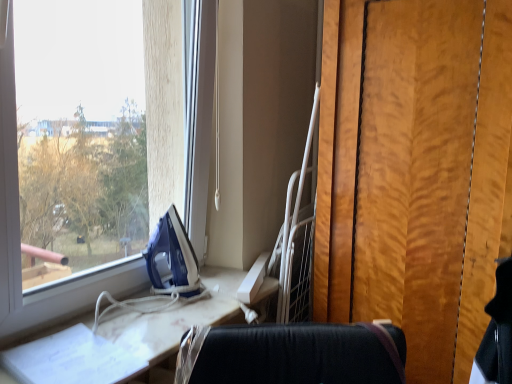
Question: Is blue plastic iron at window wider or thinner than white glossy ironing board at left?

Choices:
 (A) wide
 (B) thin

Answer: (B)

Question: From a real-world perspective, is blue plastic iron at window above or below white glossy ironing board at left?

Choices:
 (A) below
 (B) above

Answer: (B)

Question: In terms of height, does blue plastic iron at window look taller or shorter compared to white glossy ironing board at left?

Choices:
 (A) short
 (B) tall

Answer: (B)

Question: Considering the positions of point (188, 304) and point (176, 259), is point (188, 304) closer or farther from the camera than point (176, 259)?

Choices:
 (A) farther
 (B) closer

Answer: (B)

Question: Is white glossy ironing board at left inside or outside of blue plastic iron at window?

Choices:
 (A) outside
 (B) inside

Answer: (A)

Question: Considering their positions, is white glossy ironing board at left located in front of or behind blue plastic iron at window?

Choices:
 (A) front
 (B) behind

Answer: (A)

Question: Considering the positions of white glossy ironing board at left and blue plastic iron at window in the image, is white glossy ironing board at left wider or thinner than blue plastic iron at window?

Choices:
 (A) thin
 (B) wide

Answer: (B)